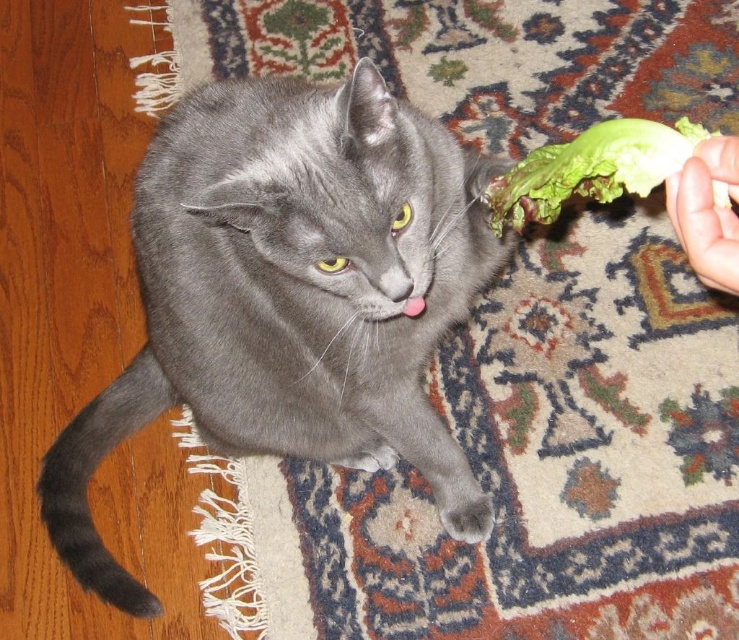
Question: Which object is farther from the camera taking this photo?

Choices:
 (A) smooth skin hand at upper right
 (B) green leafy lettuce at upper right

Answer: (B)

Question: Is the position of gray fur cat at center more distant than that of green leafy lettuce at upper right?

Choices:
 (A) yes
 (B) no

Answer: (A)

Question: Is gray fur cat at center further to the viewer compared to smooth skin hand at upper right?

Choices:
 (A) no
 (B) yes

Answer: (B)

Question: Which point appears closest to the camera in this image?

Choices:
 (A) (675, 157)
 (B) (225, 310)

Answer: (A)

Question: Which of the following is the closest to the observer?

Choices:
 (A) (721, 145)
 (B) (573, 141)
 (C) (202, 88)

Answer: (A)

Question: Does green leafy lettuce at upper right appear over smooth skin hand at upper right?

Choices:
 (A) no
 (B) yes

Answer: (B)